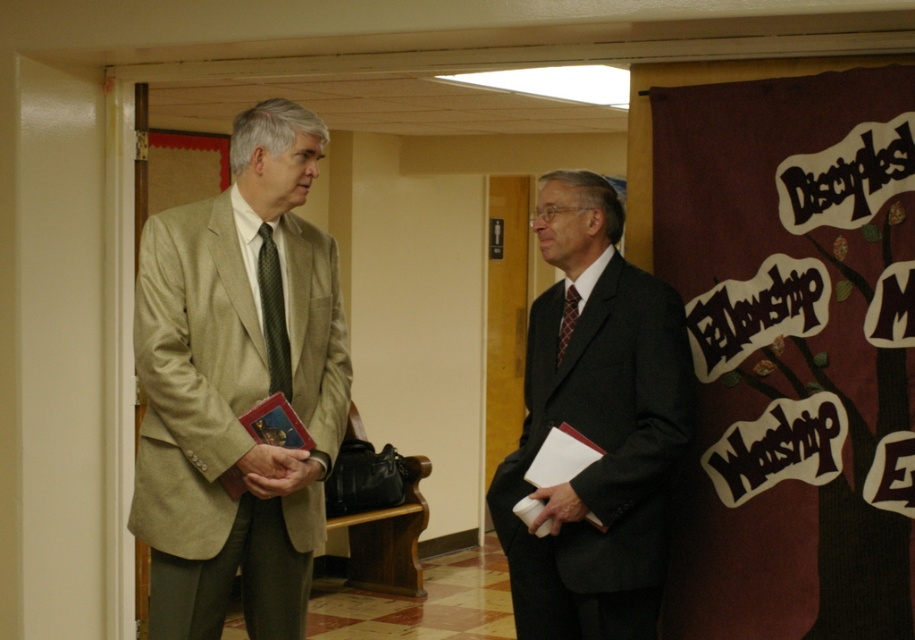
You are a tailor observing two men in a hallway. You need to determine which item, the matte beige suit at left or the green textured tie at left, requires more fabric for alterations. Based on their sizes, which one would need more fabric?

The matte beige suit at left has a larger size compared to the green textured tie at left, so it would require more fabric for alterations.

You are a photographer trying to capture a candid shot of both the matte beige suit at left and the green textured tie at left. Since you want to ensure both are in focus, which part of the scene should you focus on to include both?

You should focus on the matte beige suit at left because it is much taller than the green textured tie at left, ensuring both will be in focus when focusing on the taller object.

You are an architect designing a layout for a meeting space. You need to place a table between the green textured tie at left and another object. What coordinate should the table be placed at to ensure it is exactly halfway between them?

The table should be placed at the midpoint between the green textured tie at left and the other object. However, since only the coordinates of the green textured tie at left are provided, additional information about the other object is needed to determine the exact midpoint.